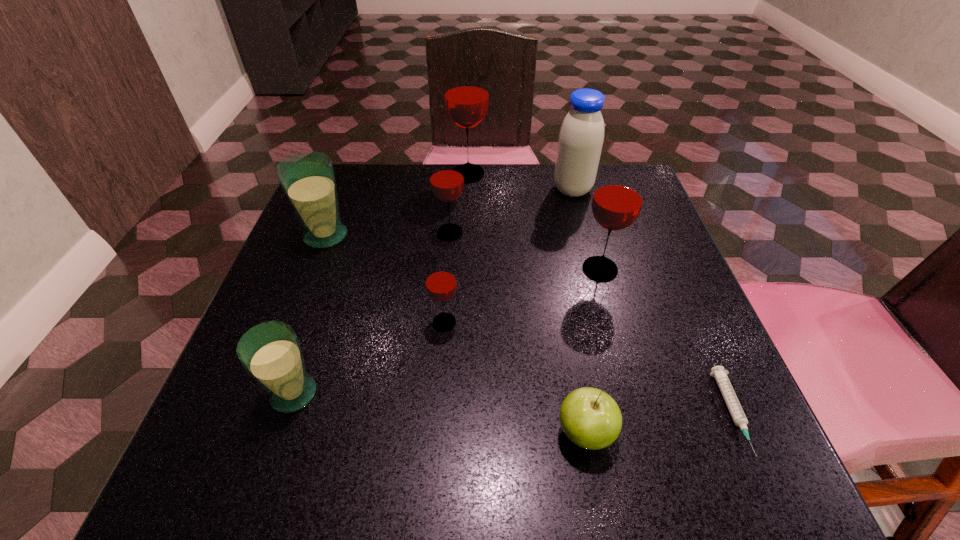
Locate an element on the screen. This screenshot has height=540, width=960. object that is at the far right corner is located at coordinates (581, 136).

Image resolution: width=960 pixels, height=540 pixels. I want to click on object present at the near right corner, so click(x=732, y=402).

Identify the location of vacant space at the far edge of the desktop. The image size is (960, 540). (536, 192).

The height and width of the screenshot is (540, 960). Identify the location of vacant region at the near edge. (350, 472).

The height and width of the screenshot is (540, 960). In the image, there is a desktop. Find the location of `free space at the left edge`. free space at the left edge is located at coordinates (358, 244).

Locate an element on the screen. free space at the right edge is located at coordinates (615, 283).

Find the location of `vacant space at the far left corner of the desktop`. vacant space at the far left corner of the desktop is located at coordinates (352, 170).

Where is `vacant space at the near left corner`? vacant space at the near left corner is located at coordinates (255, 437).

Find the location of a particular element. free space at the near right corner of the desktop is located at coordinates (774, 483).

Find the location of a particular element. vacant region between the third biggest red glass and the shortest object is located at coordinates (591, 323).